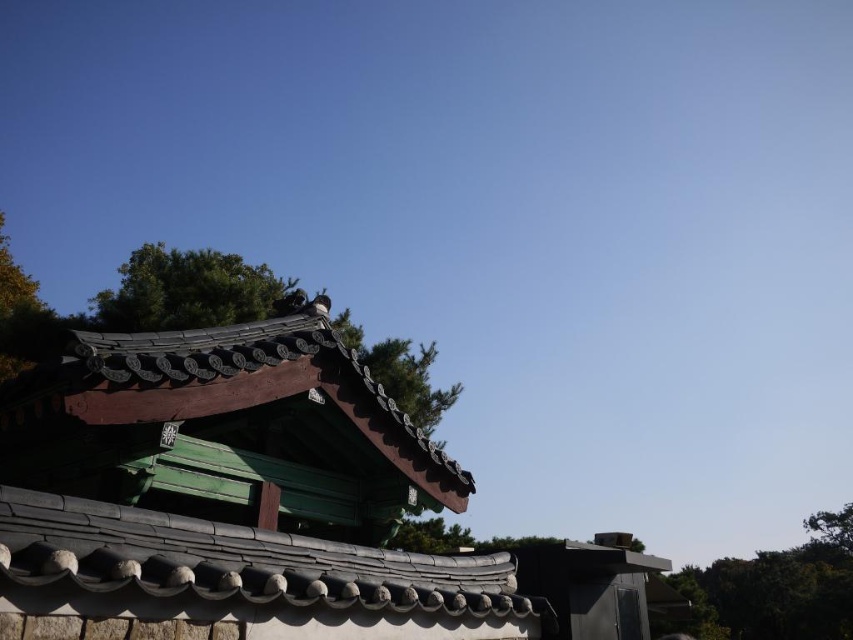
Question: Among these objects, which one is farthest from the camera?

Choices:
 (A) green textured tree at center
 (B) shiny dark green roof at left

Answer: (A)

Question: Which point is farther to the camera?

Choices:
 (A) (708, 584)
 (B) (399, 538)
 (C) (125, 349)

Answer: (A)

Question: Observing the image, what is the correct spatial positioning of shiny dark green roof at left in reference to green textured tree at center?

Choices:
 (A) below
 (B) above

Answer: (B)

Question: Does shiny dark green roof at left lie in front of green textured tree at center?

Choices:
 (A) no
 (B) yes

Answer: (B)

Question: Which point is closer to the camera?

Choices:
 (A) green leafy tree at upper left
 (B) green textured tree at center

Answer: (B)

Question: In this image, where is shiny dark green roof at left located relative to green textured tree at center?

Choices:
 (A) left
 (B) right

Answer: (A)